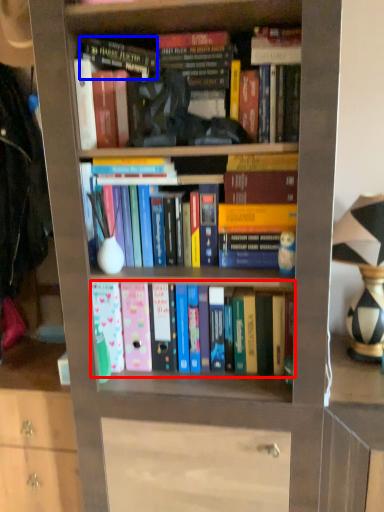
Question: Which of the following is the farthest to the observer, book (highlighted by a red box) or book (highlighted by a blue box)?

Choices:
 (A) book
 (B) book

Answer: (A)